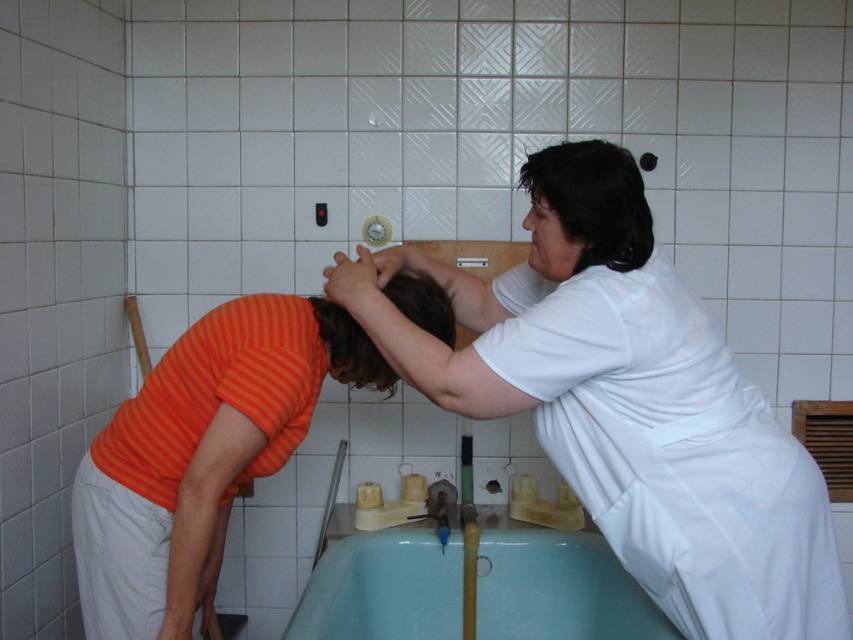
Describe the element at coordinates (625, 401) in the screenshot. I see `white matte shirt at upper right` at that location.

Is white matte shirt at upper right bigger than orange striped shirt at lower left?

Correct, white matte shirt at upper right is larger in size than orange striped shirt at lower left.

Measure the distance between white matte shirt at upper right and camera.

white matte shirt at upper right and camera are 4.38 feet apart.

Image resolution: width=853 pixels, height=640 pixels. I want to click on white matte shirt at upper right, so click(625, 401).

Who is more distant from viewer, (224, 524) or (366, 381)?

The point (224, 524) is behind.

Between orange striped shirt at lower left and dark brown hair at center, which one has more height?

Standing taller between the two is orange striped shirt at lower left.

Who is more forward, (119, 534) or (361, 337)?

Positioned in front is point (119, 534).

The width and height of the screenshot is (853, 640). I want to click on orange striped shirt at lower left, so pos(202,452).

In the scene shown: Between white matte shirt at upper right and teal plastic bath at lower center, which one has more height?

With more height is white matte shirt at upper right.

Between point (761, 416) and point (577, 570), which one is positioned in front?

Positioned in front is point (761, 416).

In order to click on white matte shirt at upper right in this screenshot , I will do `click(625, 401)`.